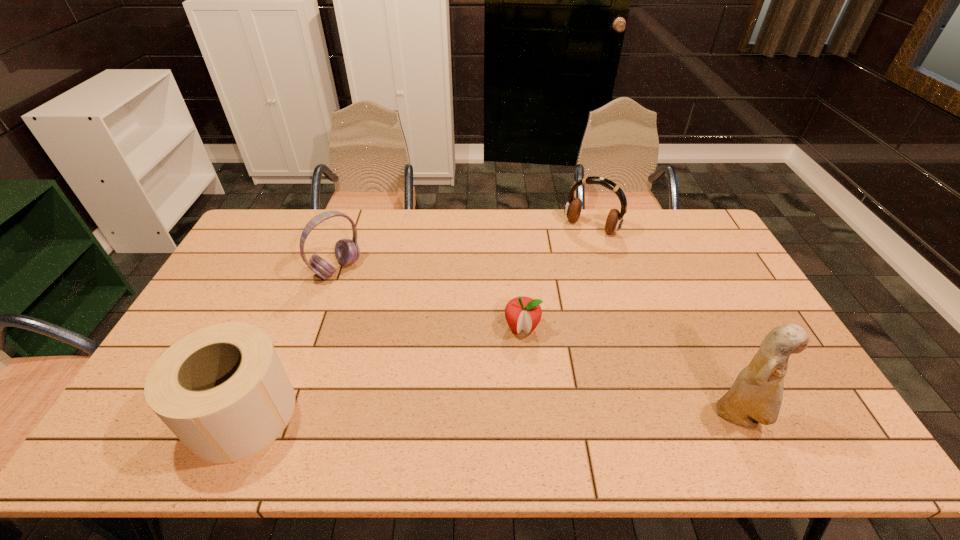
Image resolution: width=960 pixels, height=540 pixels. What are the coordinates of `toilet tissue` in the screenshot? It's located at [x=222, y=390].

You are a GUI agent. You are given a task and a screenshot of the screen. Output one action in this format:
    pyautogui.click(x=<x>, y=<y>)
    Task: Click on the rightmost object
    This screenshot has width=960, height=540.
    Given the screenshot: What is the action you would take?
    pyautogui.click(x=755, y=397)

The width and height of the screenshot is (960, 540). Identify the location of figurine. pos(755,397).

Find the location of a particular element. The image size is (960, 540). the nearer headset is located at coordinates (347, 251).

You are a GUI agent. You are given a task and a screenshot of the screen. Output one action in this format:
    pyautogui.click(x=<x>, y=<y>)
    Task: Click on the fourth nearest object
    This screenshot has height=540, width=960.
    Given the screenshot: What is the action you would take?
    [347, 251]

Find the location of a particular element. This screenshot has width=960, height=540. the third farthest object is located at coordinates (x=523, y=313).

I want to click on the third object from right to left, so click(x=523, y=313).

This screenshot has height=540, width=960. Find the location of `the second object from right to left`. the second object from right to left is located at coordinates (573, 208).

The height and width of the screenshot is (540, 960). I want to click on the farthest object, so click(573, 208).

Locate an element on the screen. The height and width of the screenshot is (540, 960). free space located on the right of the toilet tissue is located at coordinates pyautogui.click(x=350, y=413).